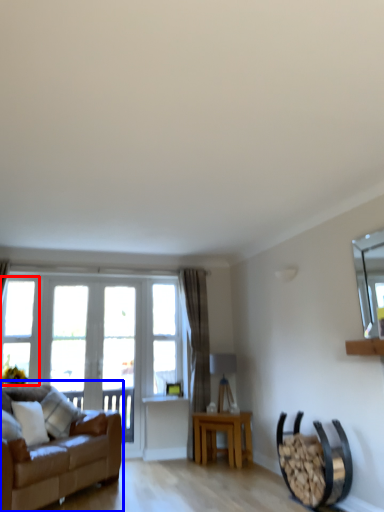
Question: Which point is further to the camera, window (highlighted by a red box) or studio couch (highlighted by a blue box)?

Choices:
 (A) window
 (B) studio couch

Answer: (A)